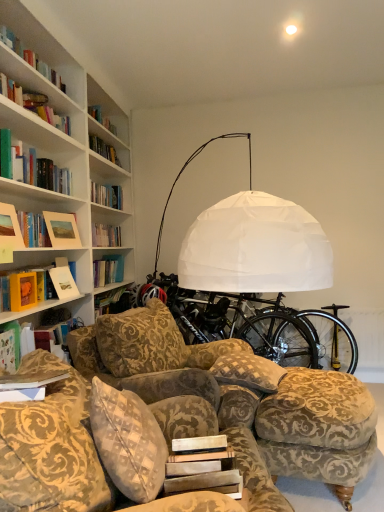
Question: In terms of height, does velvet-patterned couch at lower center look taller or shorter compared to white paper at center, which is the first paperback book in front-to-back order?

Choices:
 (A) short
 (B) tall

Answer: (B)

Question: Is point [28, 455] closer or farther from the camera than point [231, 450]?

Choices:
 (A) farther
 (B) closer

Answer: (B)

Question: Considering the real-world distances, which object is farthest from the gold-patterned fabric ottoman at lower right?

Choices:
 (A) white paper at center, the 1th paperback book viewed from the right
 (B) hardcover book at left, which ranks as the first book in top-to-bottom order
 (C) velvet-patterned couch at lower center
 (D) matte green book at left, which is the first book in bottom-to-top order
 (E) black matte bicycle wheel at center

Answer: (B)

Question: Based on their relative distances, which object is farther from the patterned fabric pillow at center?

Choices:
 (A) matte yellow book at left, positioned as the 1th paperback book in back-to-front order
 (B) matte green book at left, the second book in the back-to-front sequence
 (C) white paper at center, the 2th paperback book from the top
 (D) black matte bicycle at center
 (E) black matte bicycle wheel at center

Answer: (A)